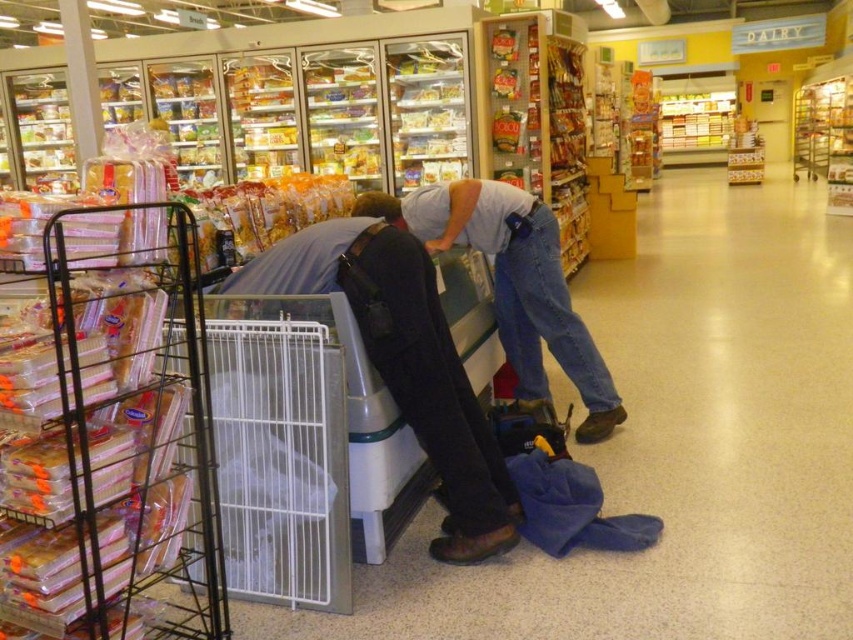
Does dark gray fabric at lower center appear over denim jeans at center?

No, dark gray fabric at lower center is not above denim jeans at center.

Who is more forward, (471, 456) or (419, 188)?

Point (471, 456) is more forward.

What do you see at coordinates (404, 364) in the screenshot? The image size is (853, 640). I see `dark gray fabric at lower center` at bounding box center [404, 364].

Identify the location of dark gray fabric at lower center. (404, 364).